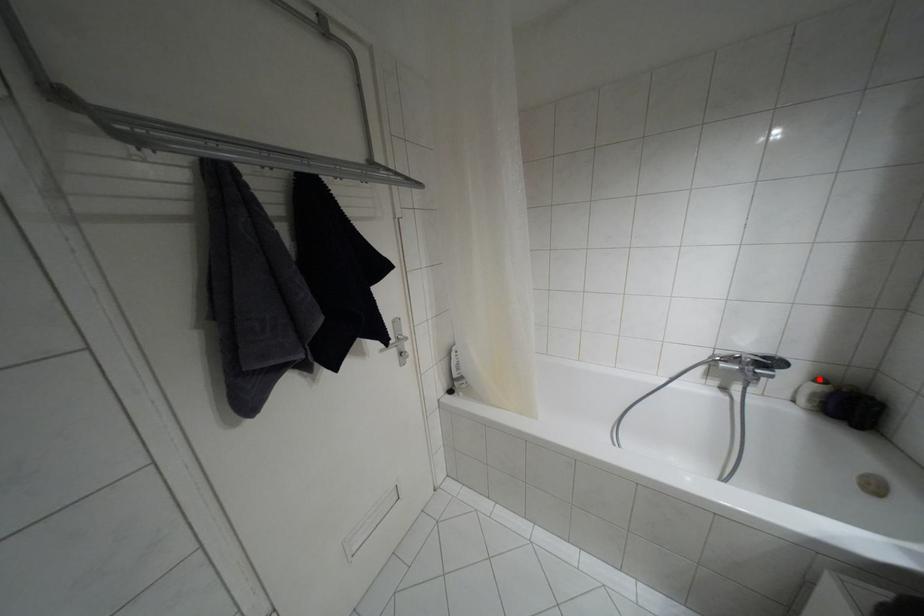
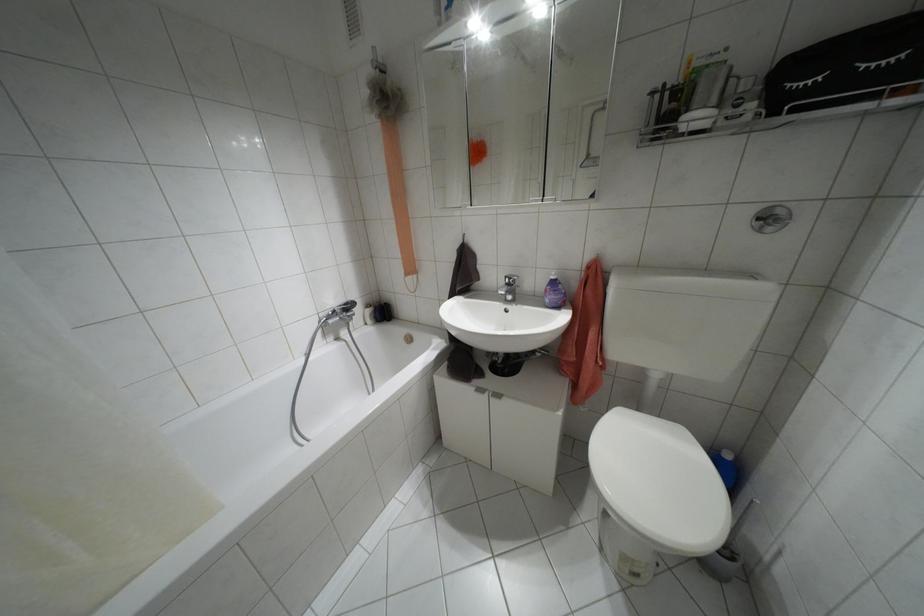
Find the pixel in the second image that matches the highlighted location in the first image.

(367, 305)